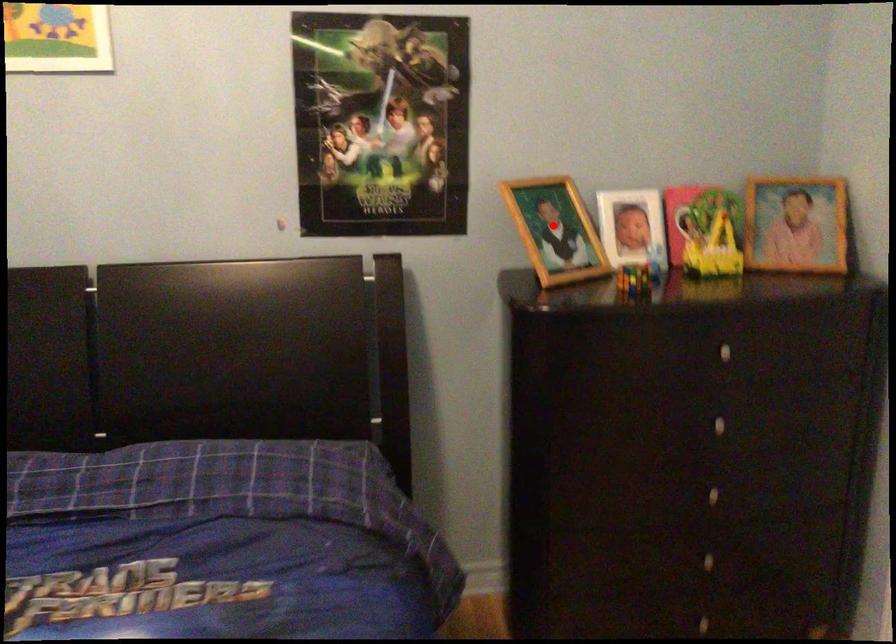
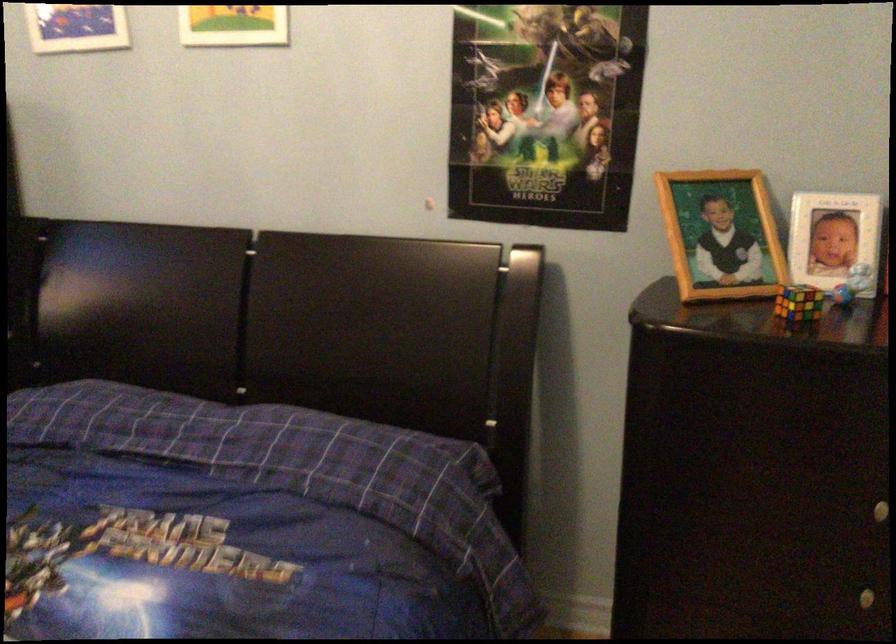
Where in the second image is the point corresponding to the highlighted location from the first image?

(720, 234)